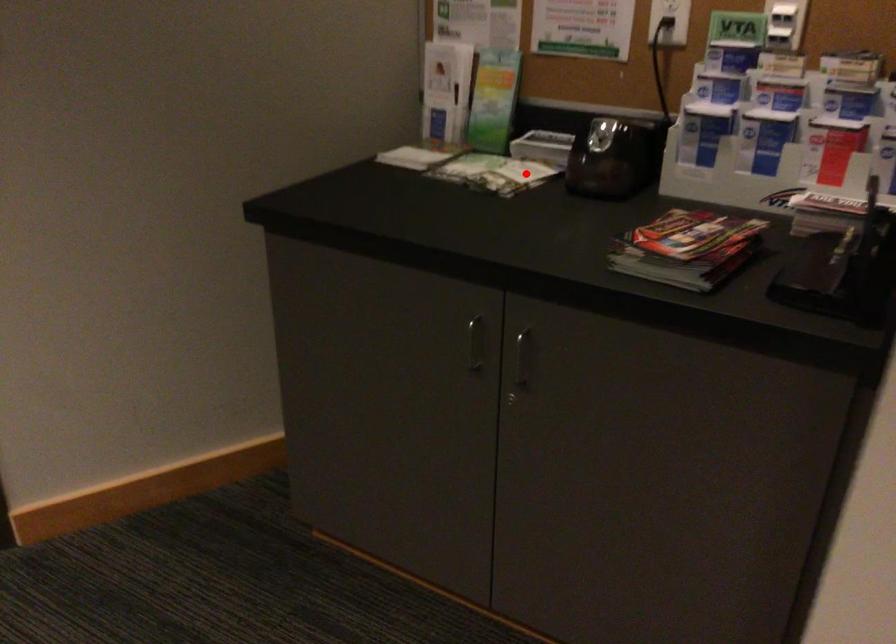
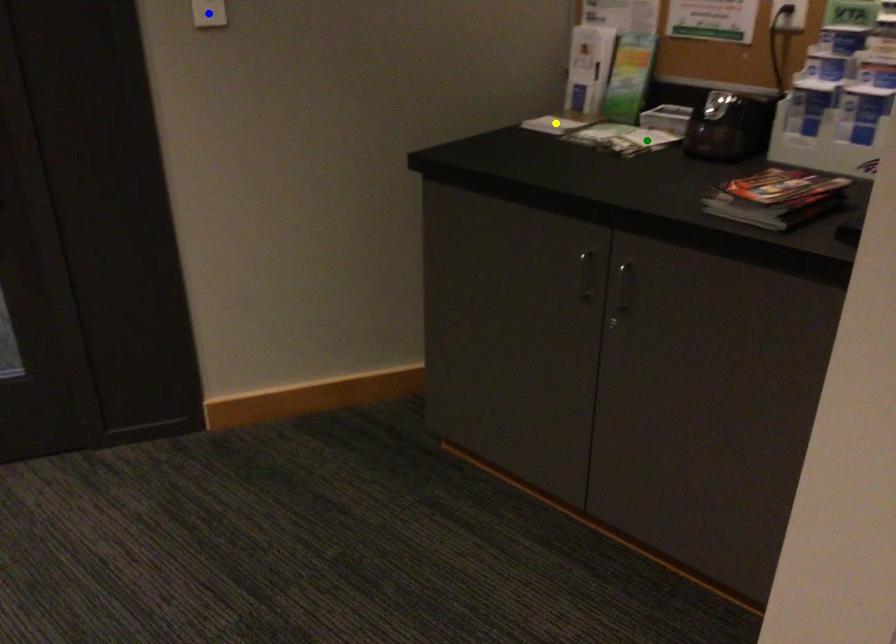
Question: I am providing you with two images of the same scene from different viewpoints. A red point is marked on the first image. You are given multiple points on the second image. Can you choose the point in image 2 that corresponds to the point in image 1?

Choices:
 (A) green point
 (B) yellow point
 (C) blue point

Answer: (A)